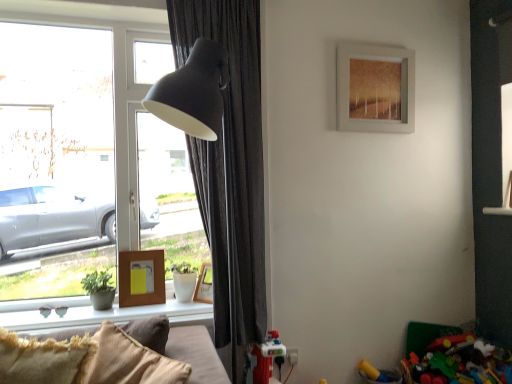
Question: Do you think dark grey fabric curtain at left is within smooth concrete window sill at lower left, or outside of it?

Choices:
 (A) outside
 (B) inside

Answer: (A)

Question: From the image's perspective, is dark grey fabric curtain at left positioned above or below smooth concrete window sill at lower left?

Choices:
 (A) below
 (B) above

Answer: (B)

Question: Estimate the real-world distances between objects in this image. Which object is closer to the velvet beige couch at lower left?

Choices:
 (A) green matte plant at lower left
 (B) matte brown picture frame at upper center, marked as the 1th picture frame in a right-to-left arrangement
 (C) woodenobject at lower left, which is the second picture frame in bottom-to-top order
 (D) wooden photo frame at lower left, the second picture frame positioned from the left
 (E) dark grey fabric curtain at left

Answer: (C)

Question: Estimate the real-world distances between objects in this image. Which object is farther from the woodenobject at lower left, arranged as the 2th picture frame when viewed from the top?

Choices:
 (A) wooden photo frame at lower left, the second picture frame positioned from the left
 (B) transparent glass window at left
 (C) velvet beige couch at lower left
 (D) green matte plant at lower left
 (E) smooth concrete window sill at lower left

Answer: (C)